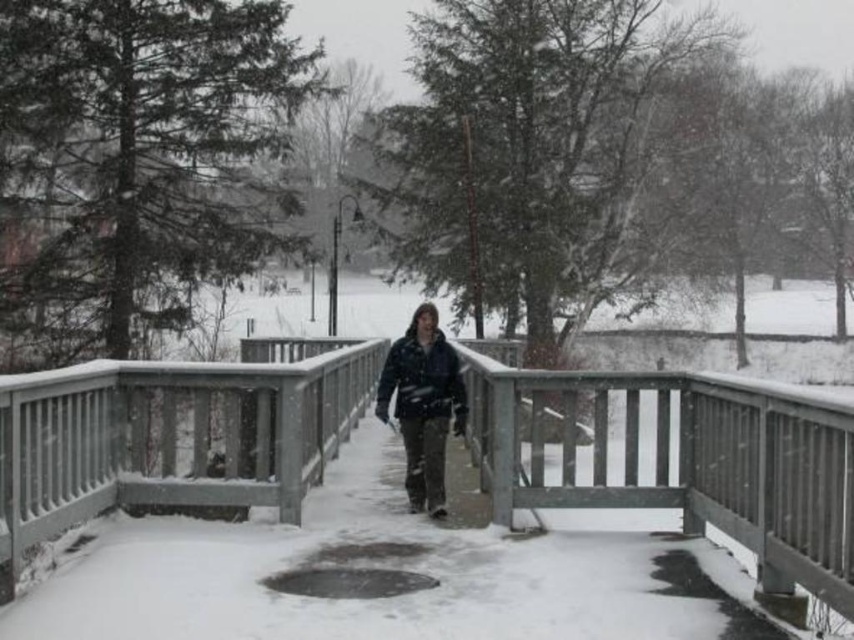
Question: Considering the relative positions of wooden bridge at center and dark blue jacket at center in the image provided, where is wooden bridge at center located with respect to dark blue jacket at center?

Choices:
 (A) below
 (B) above

Answer: (A)

Question: Can you confirm if wooden bridge at center is smaller than dark blue jacket at center?

Choices:
 (A) yes
 (B) no

Answer: (B)

Question: Is wooden bridge at center below dark blue jacket at center?

Choices:
 (A) no
 (B) yes

Answer: (B)